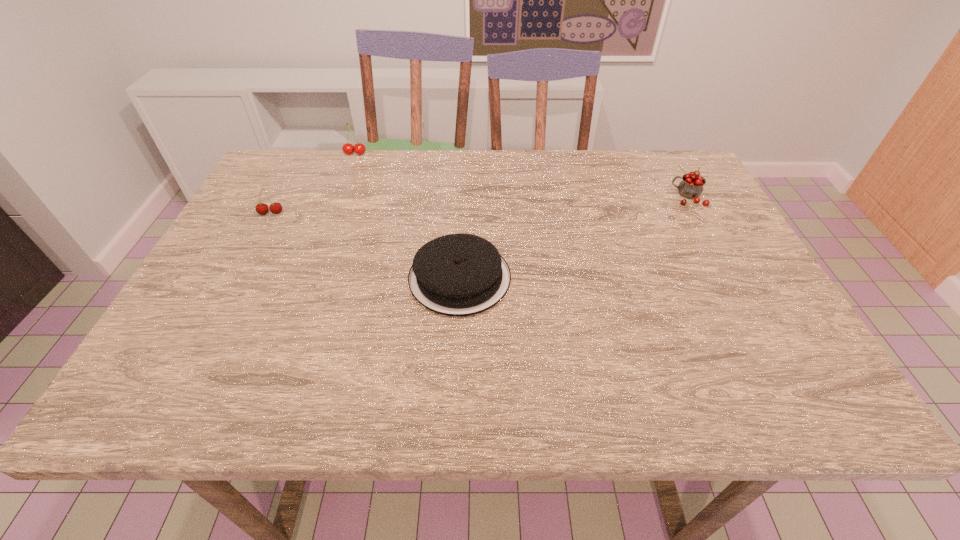
In the image, there is a desktop. At what (x,y) coordinates should I click in order to perform the action: click on free region at the far left corner. Please return your answer as a coordinate pair (x, y). Looking at the image, I should click on (300, 150).

What are the coordinates of `vacant area that lies between the second farthest cherry and the second nearest object` in the screenshot? It's located at (479, 205).

Find the location of a particular element. free space that is in between the rightmost cherry and the shortest object is located at coordinates (573, 238).

Where is `vacant space that's between the rightmost cherry and the shortest object`? This screenshot has height=540, width=960. vacant space that's between the rightmost cherry and the shortest object is located at coordinates (573, 238).

Where is `vacant space in between the second farthest cherry and the farthest cherry`? The width and height of the screenshot is (960, 540). vacant space in between the second farthest cherry and the farthest cherry is located at coordinates (521, 175).

Locate an element on the screen. The image size is (960, 540). blank region between the nearest object and the second farthest object is located at coordinates (573, 238).

You are a GUI agent. You are given a task and a screenshot of the screen. Output one action in this format:
    pyautogui.click(x=<x>, y=<y>)
    Task: Click on the free area in between the farthest cherry and the second object from right to left
    Image resolution: width=960 pixels, height=540 pixels.
    Given the screenshot: What is the action you would take?
    click(x=407, y=216)

Where is `vacant space that is in between the nearest object and the leftmost cherry`? The width and height of the screenshot is (960, 540). vacant space that is in between the nearest object and the leftmost cherry is located at coordinates (366, 246).

Locate an element on the screen. This screenshot has width=960, height=540. free space between the rightmost object and the leftmost object is located at coordinates (479, 205).

You are a GUI agent. You are given a task and a screenshot of the screen. Output one action in this format:
    pyautogui.click(x=<x>, y=<y>)
    Task: Click on the free spot between the pancake and the leftmost cherry
    The height and width of the screenshot is (540, 960).
    Given the screenshot: What is the action you would take?
    pyautogui.click(x=366, y=246)